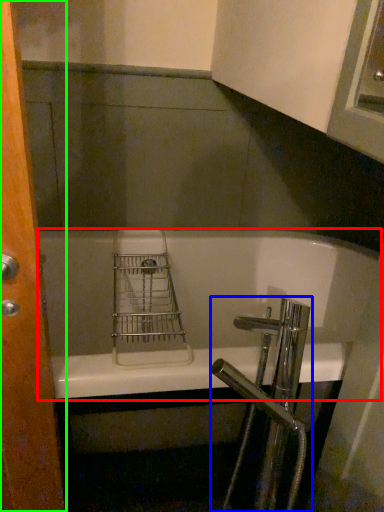
Question: Based on their relative distances, which object is farther from bathtub (highlighted by a red box)? Choose from tap (highlighted by a blue box) and screen door (highlighted by a green box).

Choices:
 (A) tap
 (B) screen door

Answer: (B)